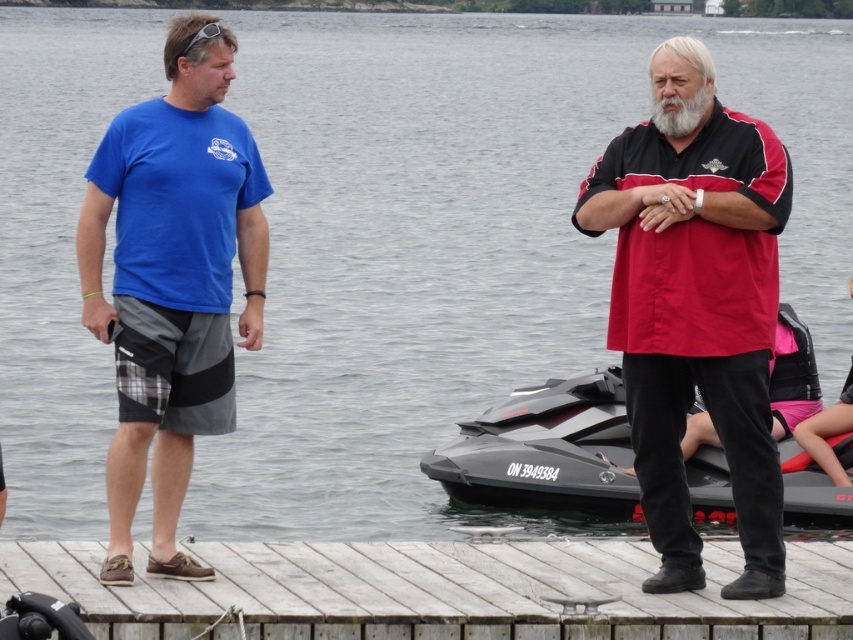
You are standing on the wooden dock and want to place a small flag at the point closer to you between the two points marked as point (763, 534) and point (697, 106). Which point should you choose?

You should choose point (763, 534) because it is closer to the viewer than point (697, 106).

You are standing at the point with coordinates (439, 589). What material are you standing on?

The material at point (439, 589) is wooden.